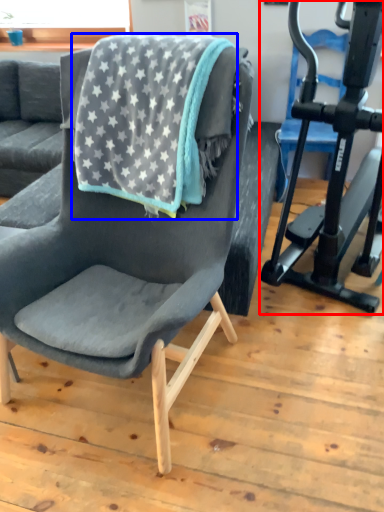
Question: Which of the following is the closest to the observer, stationary bicycle (highlighted by a red box) or beach towel (highlighted by a blue box)?

Choices:
 (A) stationary bicycle
 (B) beach towel

Answer: (A)